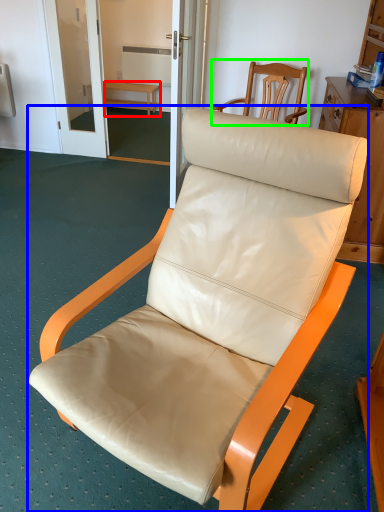
Question: Based on their relative distances, which object is farther from furniture (highlighted by a red box)? Choose from chair (highlighted by a blue box) and chair (highlighted by a green box).

Choices:
 (A) chair
 (B) chair

Answer: (A)